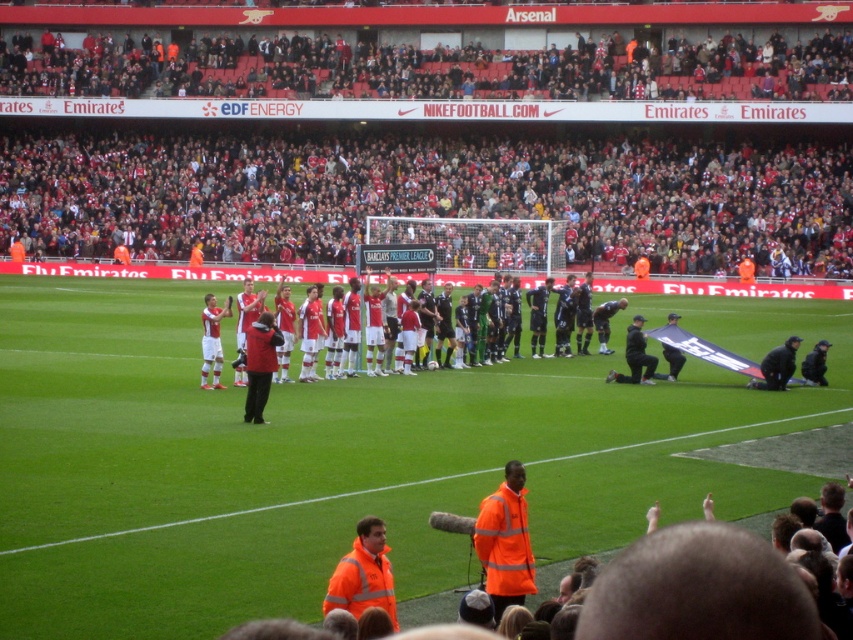
Is dark blue jacket at center below dark blue jersey at center?

Yes, dark blue jacket at center is below dark blue jersey at center.

Can you confirm if dark blue jacket at center is taller than dark blue jersey at center?

Incorrect, dark blue jacket at center's height is not larger of dark blue jersey at center's.

Where is `dark blue jacket at center`? dark blue jacket at center is located at coordinates (815, 364).

Is red fabric crowd at upper center positioned before dark blue jacket at center?

No, red fabric crowd at upper center is behind dark blue jacket at center.

Which is behind, point (741, 72) or point (802, 378)?

Point (741, 72)

You are a GUI agent. You are given a task and a screenshot of the screen. Output one action in this format:
    pyautogui.click(x=<x>, y=<y>)
    Task: Click on the red fabric crowd at upper center
    The height and width of the screenshot is (640, 853).
    Given the screenshot: What is the action you would take?
    pyautogui.click(x=426, y=193)

Can you confirm if high visibility jacket at center is smaller than dark blue jacket at center?

No, high visibility jacket at center is not smaller than dark blue jacket at center.

Is the position of high visibility jacket at center more distant than that of dark blue jacket at center?

No.

Where is `high visibility jacket at center`? The height and width of the screenshot is (640, 853). high visibility jacket at center is located at coordinates tap(505, 541).